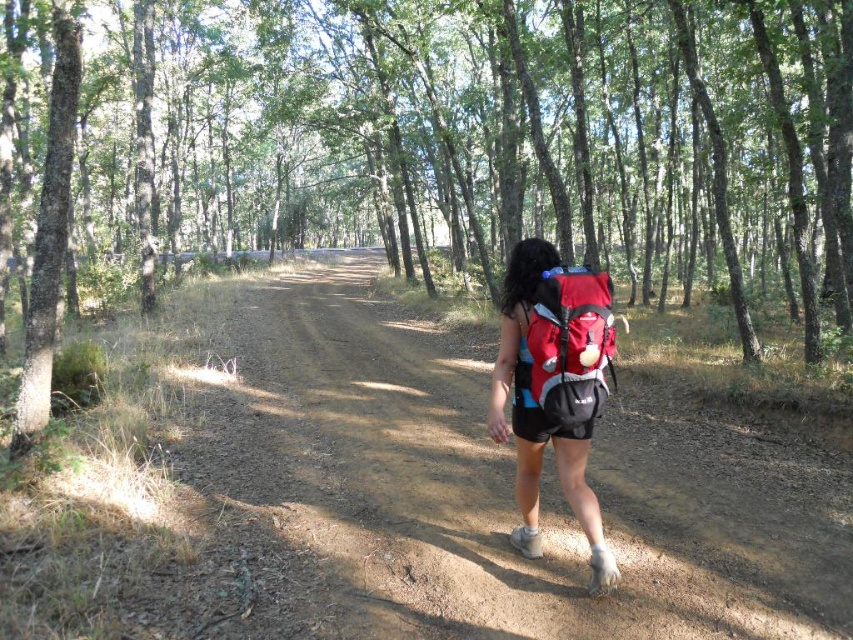
You are a hiker who wants to follow the dirt path in the forest. The path is marked by a point at coordinates (492,490). Based on the scene description, where should you look to find the dirt path?

The dirt path is located at the center, marked by the point at coordinates (492,490).

You are a hiker who wants to ensure your backpack is the right size for the trail. You have two backpacks in view, the matte red backpack at center and the red matte backpack at center. Which one has a greater width?

The matte red backpack at center has a greater width than the red matte backpack at center according to the description.

In the scene shown: You are a photographer aiming to capture the matte red backpack at center and the red matte backpack at center in a single frame. Given that your camera has a 50mm lens, which has a field of view that can cover 17.63 centimeters at this distance, will both items fit in the frame?

The distance between the matte red backpack at center and the red matte backpack at center is exactly 17.63 centimeters, which matches the field of view of the 50mm lens. Therefore, both items will fit within the frame.